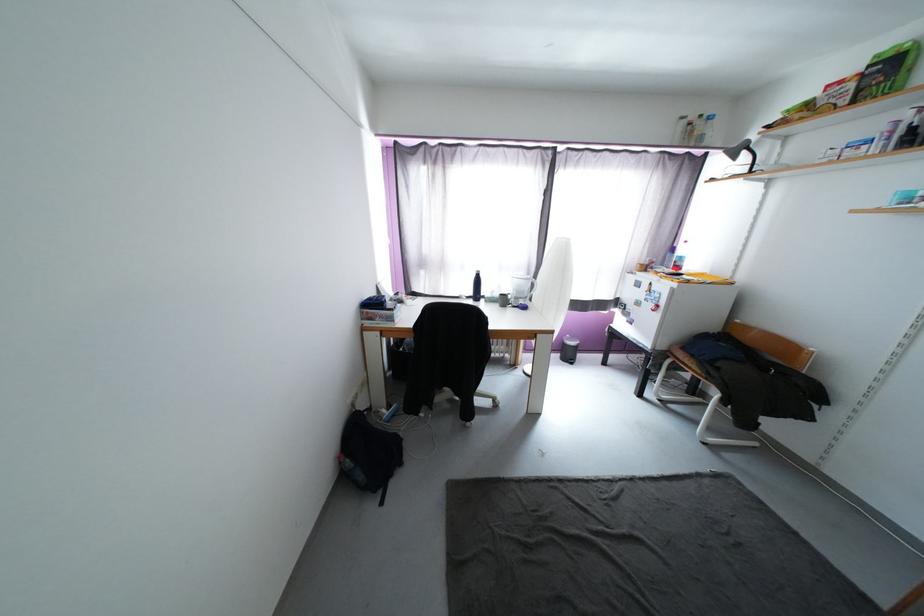
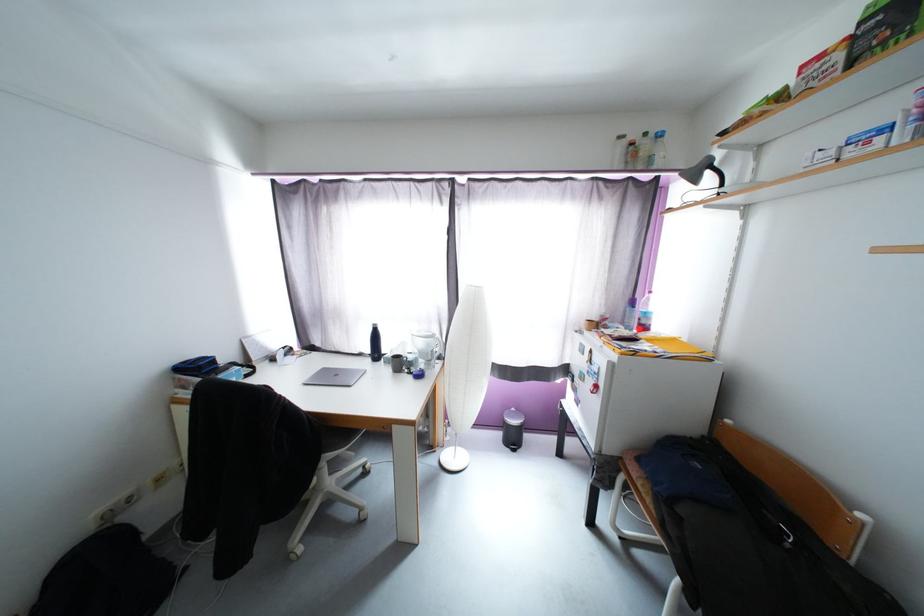
Find the pixel in the second image that matches (564,357) in the first image.

(505, 437)